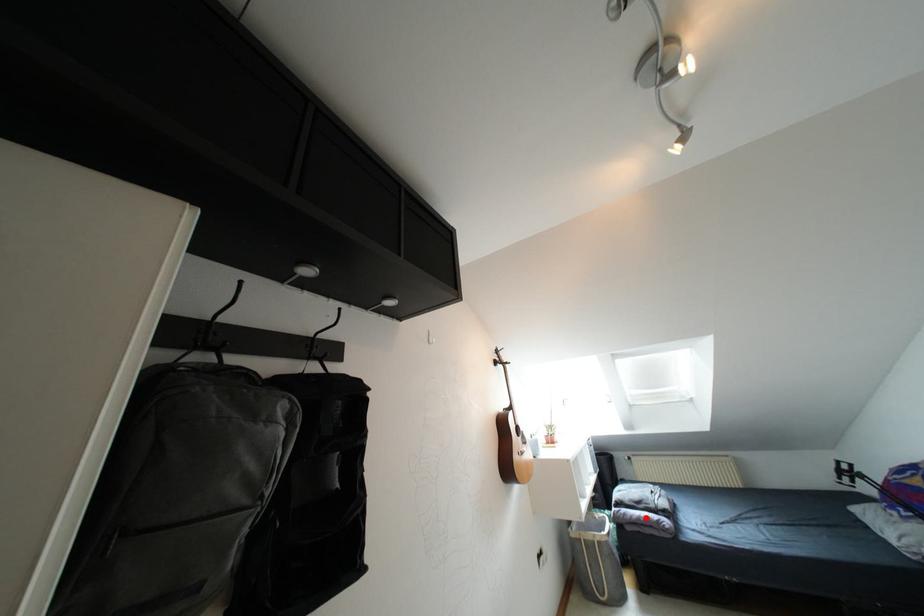
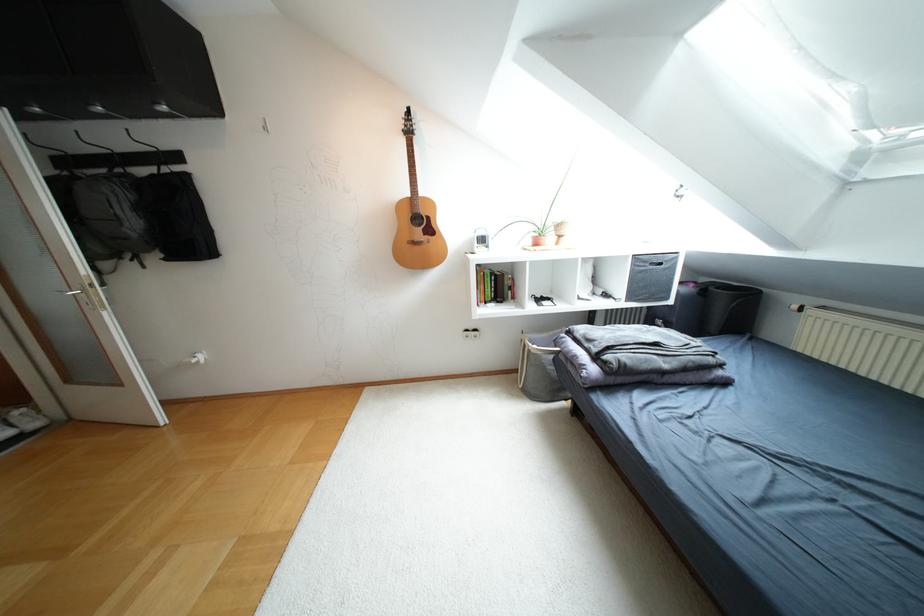
Where in the second image is the point corresponding to the highlighted location from the first image?

(575, 357)